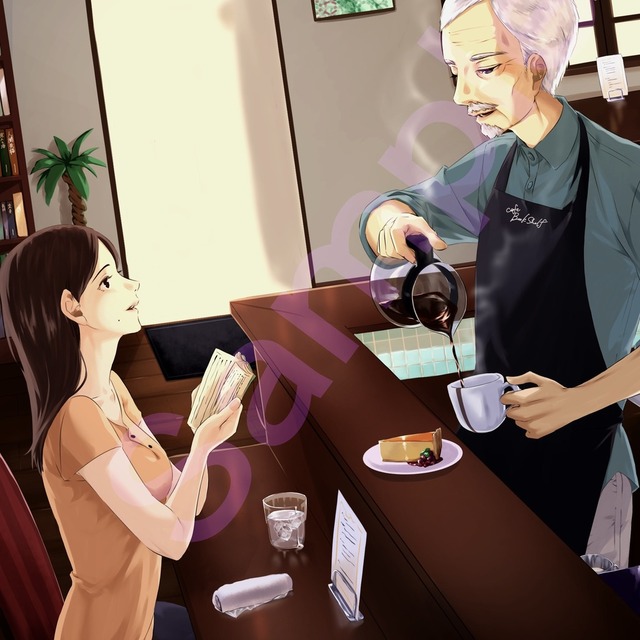
Where is `plate`? This screenshot has height=640, width=640. plate is located at coordinates (395, 465).